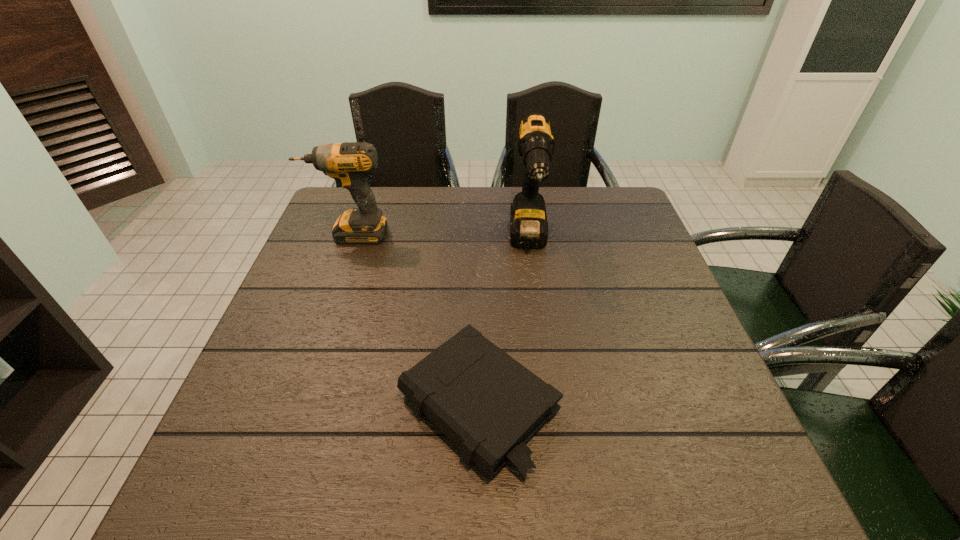
Identify the location of free spot at the far edge of the desktop. The width and height of the screenshot is (960, 540). (431, 193).

Identify the location of free spot at the near edge of the desktop. (609, 475).

At what (x,y) coordinates should I click in order to perform the action: click on free space at the left edge of the desktop. Please return your answer as a coordinate pair (x, y). Looking at the image, I should click on (291, 286).

At what (x,y) coordinates should I click in order to perform the action: click on free region at the right edge of the desktop. Please return your answer as a coordinate pair (x, y). Image resolution: width=960 pixels, height=540 pixels. Looking at the image, I should click on (616, 314).

In order to click on vacant area at the near right corner in this screenshot , I will do `click(723, 482)`.

You are a GUI agent. You are given a task and a screenshot of the screen. Output one action in this format:
    pyautogui.click(x=<x>, y=<y>)
    Task: Click on the free space between the shorter drill and the nearest object
    The width and height of the screenshot is (960, 540).
    Given the screenshot: What is the action you would take?
    pyautogui.click(x=414, y=319)

Image resolution: width=960 pixels, height=540 pixels. In order to click on vacant space that's between the left drill and the right drill in this screenshot , I will do `click(440, 239)`.

Locate an element on the screen. vacant space that is in between the shorter drill and the nearest object is located at coordinates (414, 319).

In order to click on free spot between the shorter drill and the nearest object in this screenshot , I will do `click(414, 319)`.

Find the location of a particular element. This screenshot has width=960, height=540. vacant area between the shortest object and the right drill is located at coordinates (503, 323).